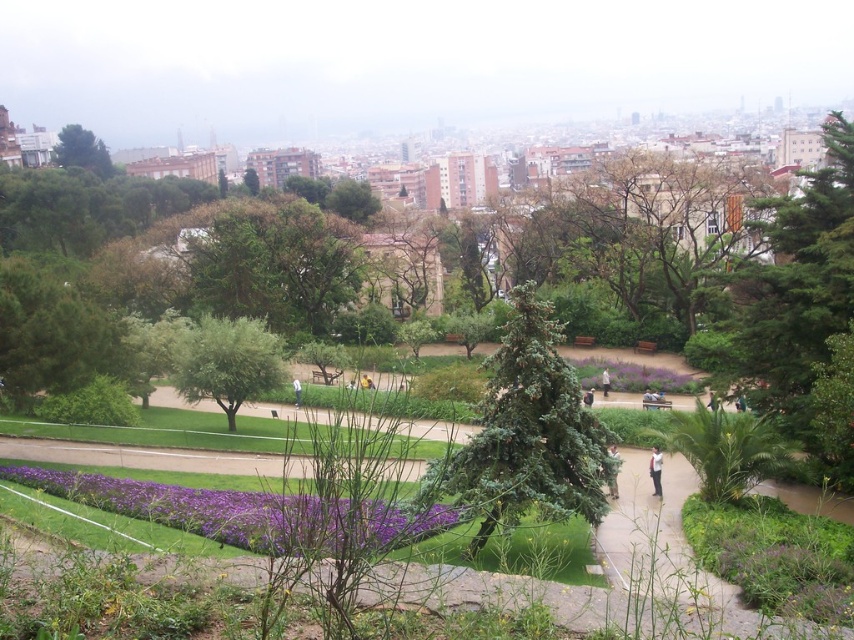
Question: Is purple matte flower at lower left to the left of brown leather backpack at center-right from the viewer's perspective?

Choices:
 (A) yes
 (B) no

Answer: (A)

Question: Considering the real-world distances, which object is closest to the light brown leather jacket at center?

Choices:
 (A) white cotton jacket at center
 (B) green textured tree at center
 (C) green textured tree at upper left

Answer: (B)

Question: Can you confirm if green textured tree at center is bigger than green textured jacket at center?

Choices:
 (A) no
 (B) yes

Answer: (B)

Question: Estimate the real-world distances between objects in this image. Which object is farther from the green textured tree at upper left?

Choices:
 (A) green textured tree at center
 (B) white cotton jacket at center

Answer: (B)

Question: Does green textured tree at center come in front of brown leather backpack at center-right?

Choices:
 (A) yes
 (B) no

Answer: (A)

Question: Which of these objects is positioned closest to the purple matte flower at lower left?

Choices:
 (A) purple matte flower at center
 (B) green textured tree at upper left
 (C) green textured tree at center
 (D) green leafy tree at center

Answer: (C)